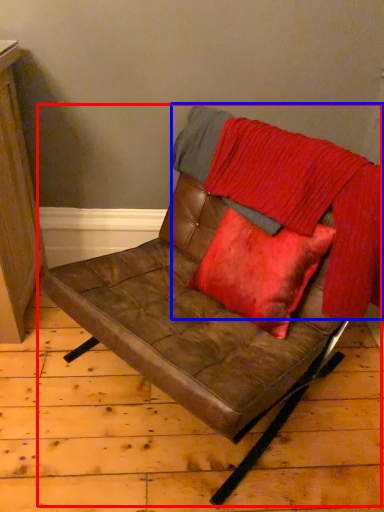
Question: Among these objects, which one is farthest to the camera, chair (highlighted by a red box) or blanket (highlighted by a blue box)?

Choices:
 (A) chair
 (B) blanket

Answer: (B)